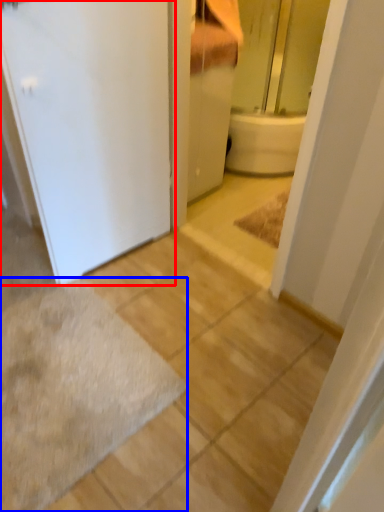
Question: Which of the following is the closest to the observer, door (highlighted by a red box) or bath mat (highlighted by a blue box)?

Choices:
 (A) door
 (B) bath mat

Answer: (A)